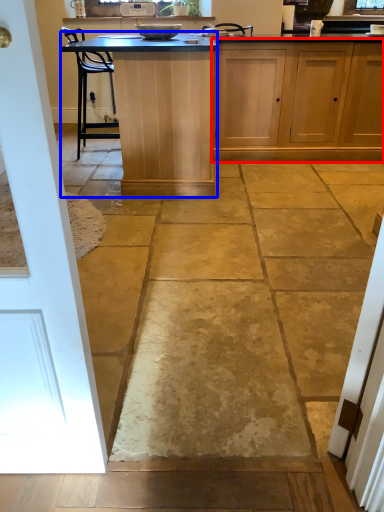
Question: Which of the following is the closest to the observer, cabinetry (highlighted by a red box) or table (highlighted by a blue box)?

Choices:
 (A) cabinetry
 (B) table

Answer: (B)